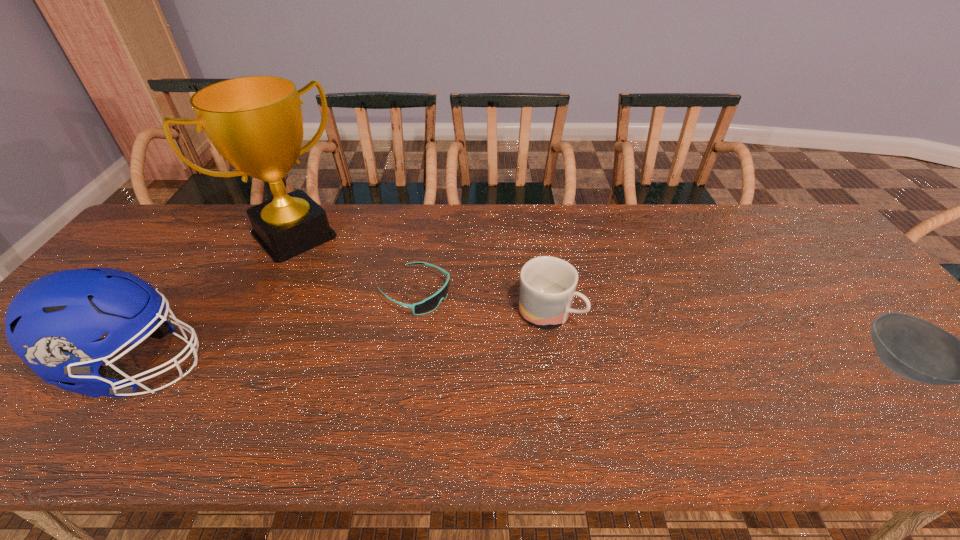
I want to click on free space on the desktop that is between the second tallest object and the rightmost object and is positioned on the front-facing side of the third object from right to left, so click(x=554, y=366).

Find the location of a particular element. This screenshot has height=540, width=960. free space on the desktop that is between the football helmet and the second shortest object and is positioned on the front-facing side of the farthest object is located at coordinates (420, 366).

Identify the location of vacant space on the desktop that is between the fourth shortest object and the rightmost object and is positioned on the side with the handle of the third tallest object. (632, 366).